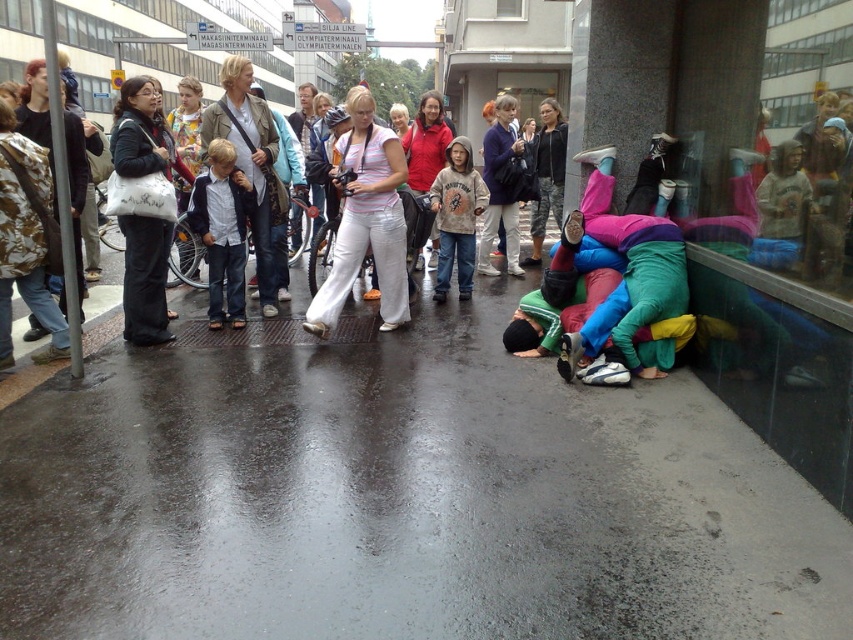
You are standing at the bus stop and want to take a photo of the wet asphalt pavement at lower center. Where exactly should you aim your camera?

You should aim your camera at point (401,497) to capture the wet asphalt pavement at lower center.

From the picture: You are a pedestrian trying to take a photo of the bus shelter. You are standing on the wet asphalt pavement at lower center. Is the brown cotton hoodie at center blocking your view of the bus shelter?

The wet asphalt pavement at lower center is in front of the brown cotton hoodie at center, so the brown cotton hoodie at center is behind you and not blocking your view.

You are standing at the point marked as point (403,221) in the image. If you want to take a photo of the bus shelter and the directional signs pointing towards SILJA LINE and OLYMPIATERMINAALI, will you be able to capture both in a single frame without moving from your current position?

The distance of point (403,221) from camera is 5.51 meters. Since the bus shelter and directional signs are within the same general area near the transportation hub, it is likely possible to capture both in a single frame without moving from your current position at point (403,221).